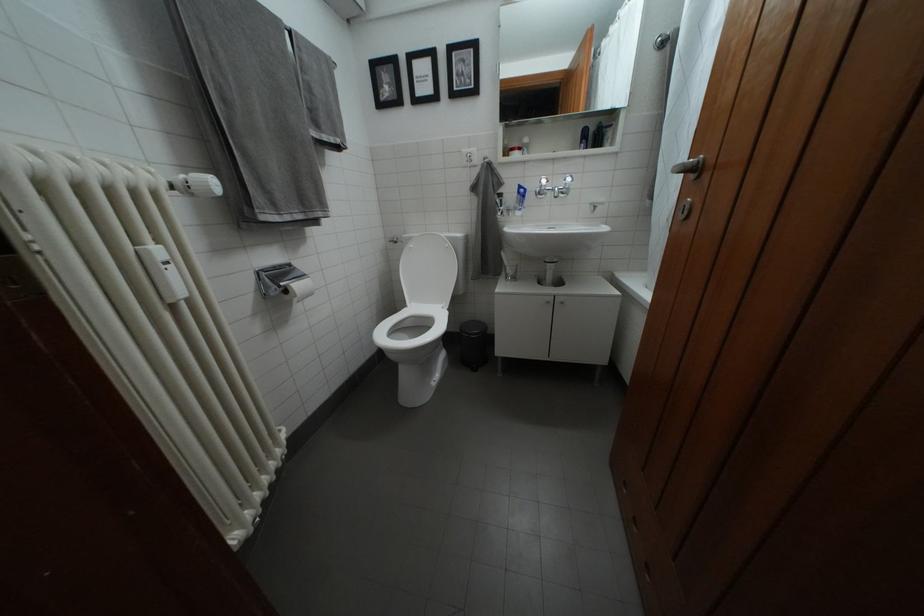
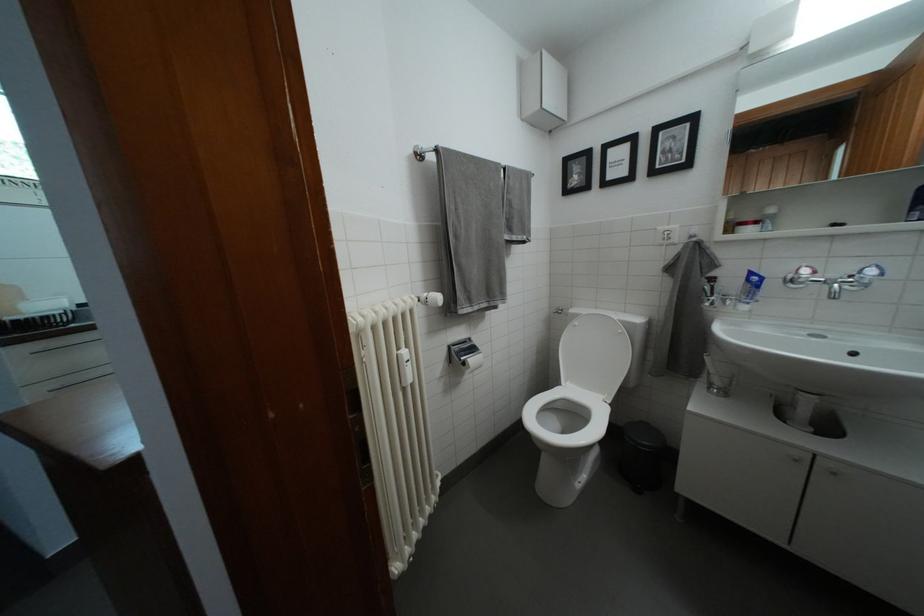
The point at (x=529, y=193) is marked in the first image. Where is the corresponding point in the second image?

(760, 280)